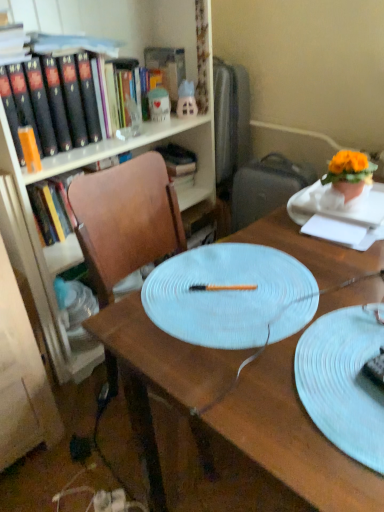
Identify the location of free space in front of orange matte flower pot at upper right. This screenshot has height=512, width=384. (349, 218).